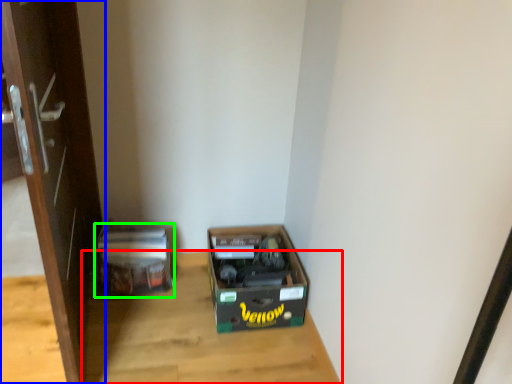
Question: Which object is the farthest from table (highlighted by a red box)? Choose among these: door (highlighted by a blue box) or cardboard box (highlighted by a green box).

Choices:
 (A) door
 (B) cardboard box

Answer: (A)